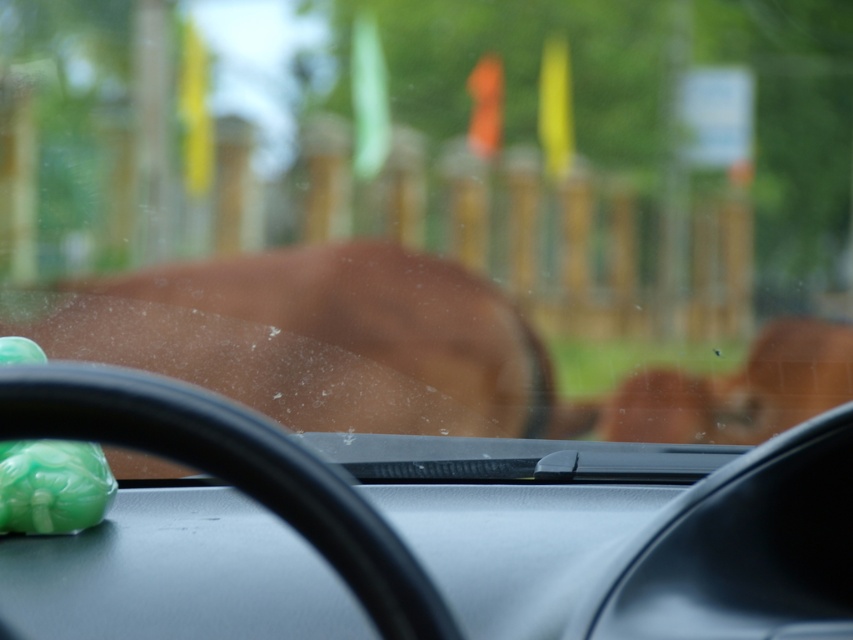
You are driving and notice two items in your car. One is a brown matte animal at center and the other is a green jade ornament at lower left. Which item is positioned to the right of the other?

The brown matte animal at center is to the right of the green jade ornament at lower left.

You are driving a car and want to know the distance between the green object on the dashboard near the bottom left corner and the point at coordinates (111, 330). Can you determine if the distance is more than 9 feet?

The distance between the green object on the dashboard near the bottom left corner and the point at coordinates (111, 330) is 9.55 feet, which is more than 9 feet.

From the picture: You are driving a car and want to know if you can safely open the front passenger side door to take a photo of the brown matte animal at center. The door opening requires 1.5 meters of clearance. Based on your current position, can you safely open the door without hitting the animal?

The distance between the brown matte animal at center and the viewer is 2.82 meters. Since the door requires 1.5 meters of clearance, and 2.82 meters is greater than 1.5 meters, you can safely open the door without hitting the animal.